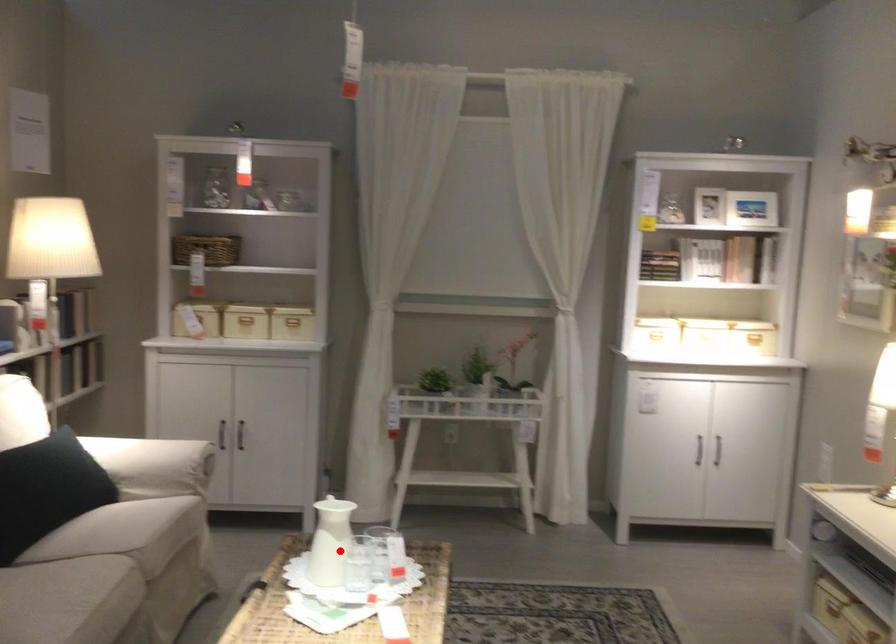
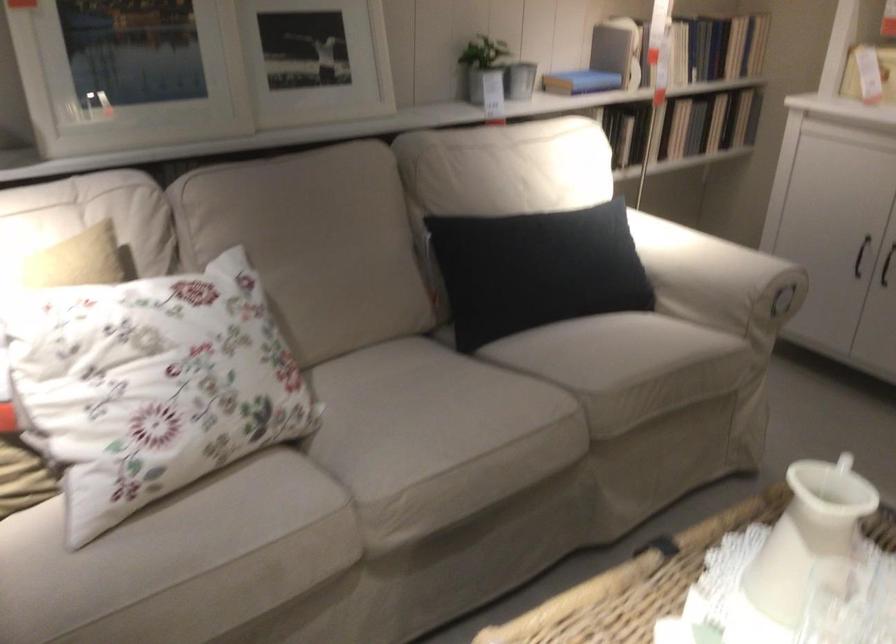
Question: A red point is marked in image1. In image2, is the corresponding 3D point closer to the camera or farther? Reply with the corresponding letter.

Choices:
 (A) The corresponding 3D point is closer.
 (B) The corresponding 3D point is farther.

Answer: (A)